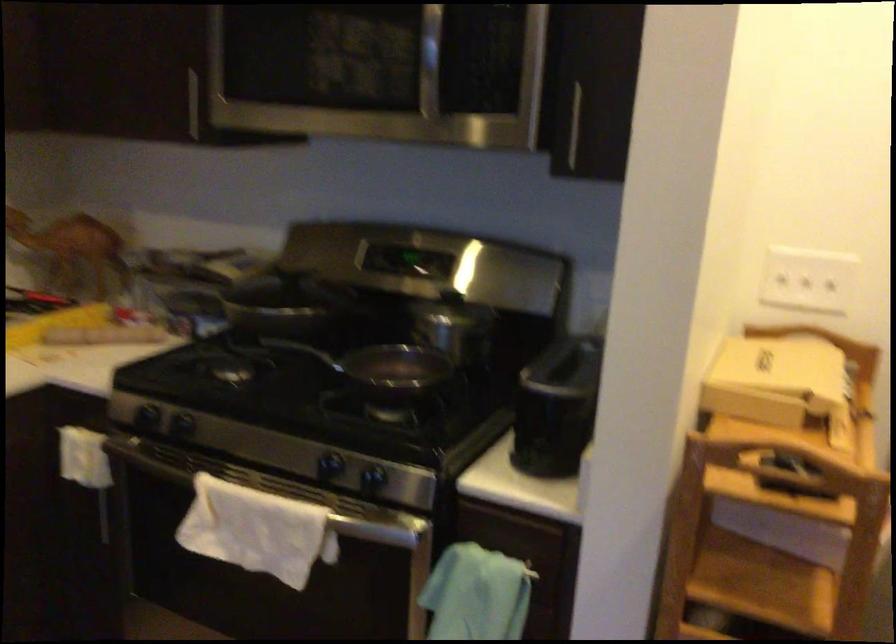
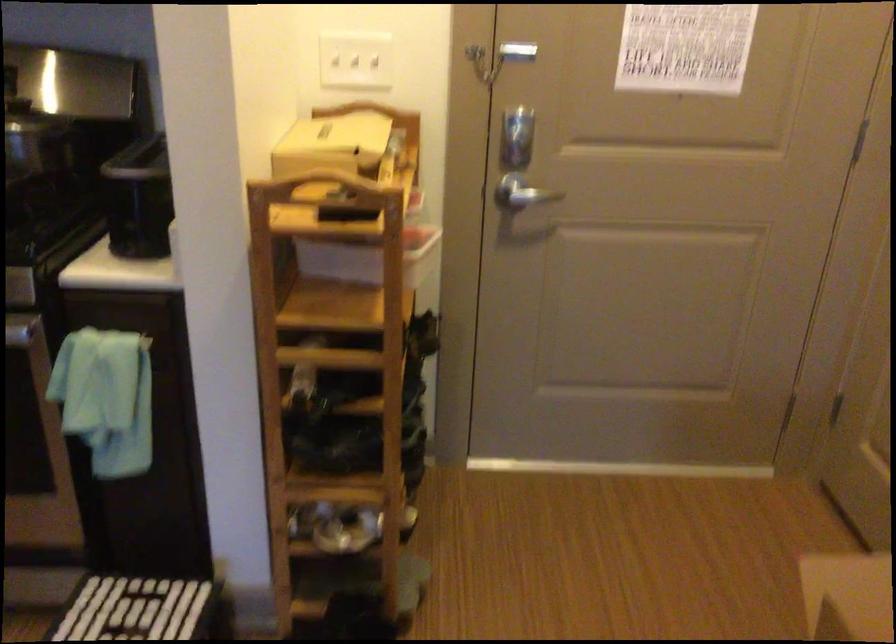
Locate, in the second image, the point that corresponds to [778,380] in the first image.

(331, 144)